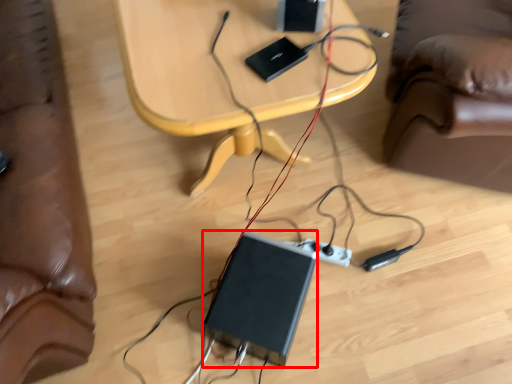
Question: Considering the relative positions of computer (annotated by the red box) and table in the image provided, where is computer (annotated by the red box) located with respect to the staircase?

Choices:
 (A) right
 (B) left

Answer: (A)